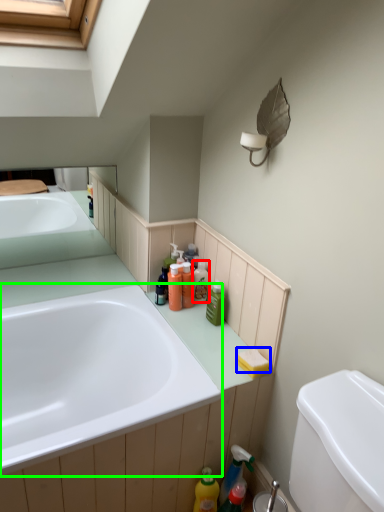
Question: Estimate the real-world distances between objects in this image. Which object is farther from toiletry (highlighted by a red box), soap (highlighted by a blue box) or bathtub (highlighted by a green box)?

Choices:
 (A) soap
 (B) bathtub

Answer: (B)